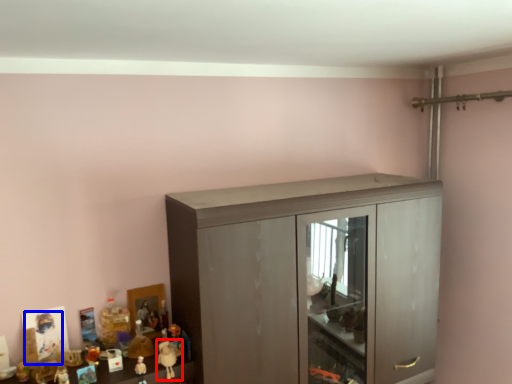
Question: Which point is closer to the camera, toy (highlighted by a red box) or toy (highlighted by a blue box)?

Choices:
 (A) toy
 (B) toy

Answer: (A)